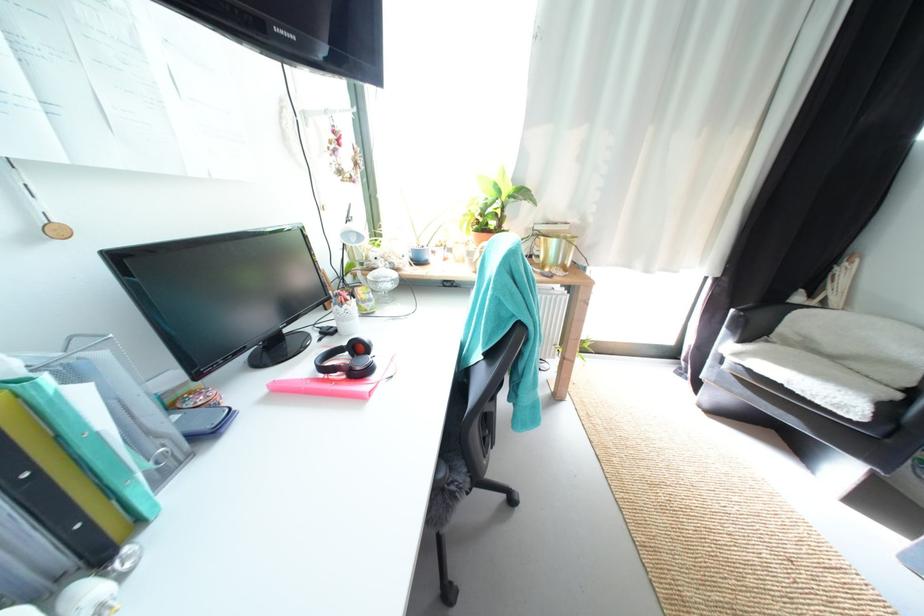
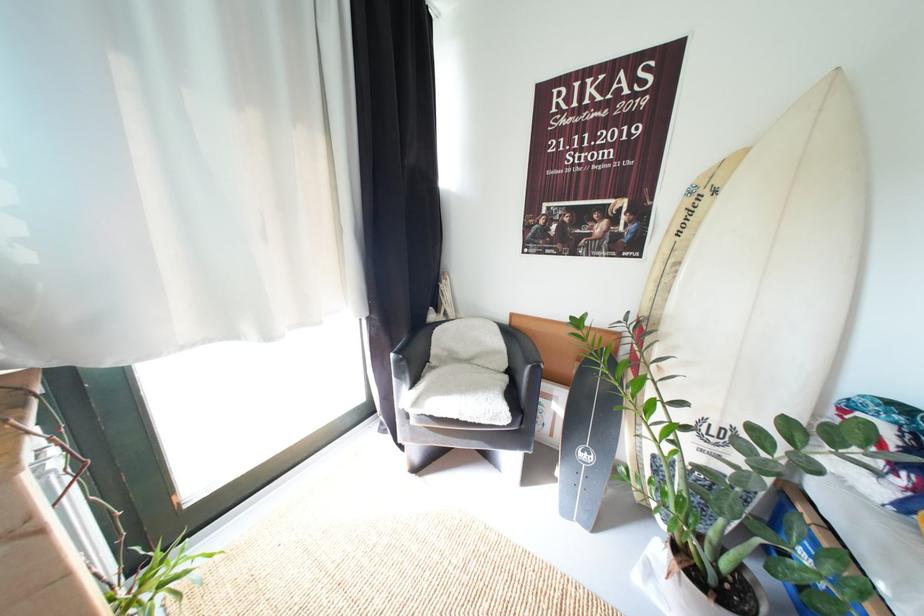
Question: The first image is from the beginning of the video and the second image is from the end. How did the camera likely rotate when shooting the video?

Choices:
 (A) Left
 (B) Right
 (C) Up
 (D) Down

Answer: (B)